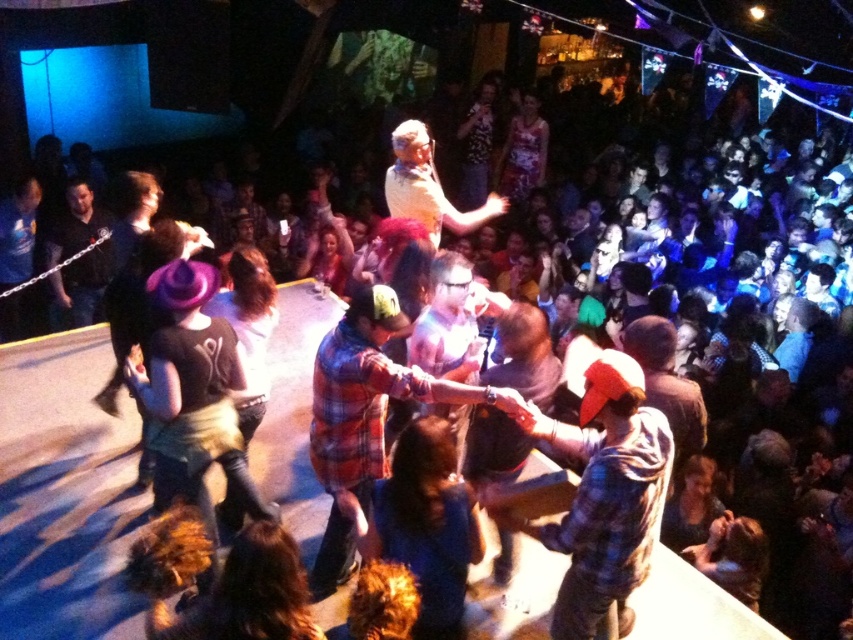
Question: Which point is closer to the camera?

Choices:
 (A) (585, 467)
 (B) (352, 544)
 (C) (59, 259)

Answer: (A)

Question: Is plaid shirt at center smaller than matte black shirt at left?

Choices:
 (A) yes
 (B) no

Answer: (B)

Question: Can you confirm if plaid shirt at center is smaller than matte black shirt at left?

Choices:
 (A) yes
 (B) no

Answer: (B)

Question: Which point is farther to the camera?

Choices:
 (A) (109, 257)
 (B) (625, 376)

Answer: (A)

Question: Which of the following is the closest to the observer?

Choices:
 (A) (82, 268)
 (B) (606, 352)
 (C) (320, 406)

Answer: (B)

Question: Can you confirm if plaid flannel shirt at center is positioned to the right of plaid shirt at center?

Choices:
 (A) no
 (B) yes

Answer: (B)